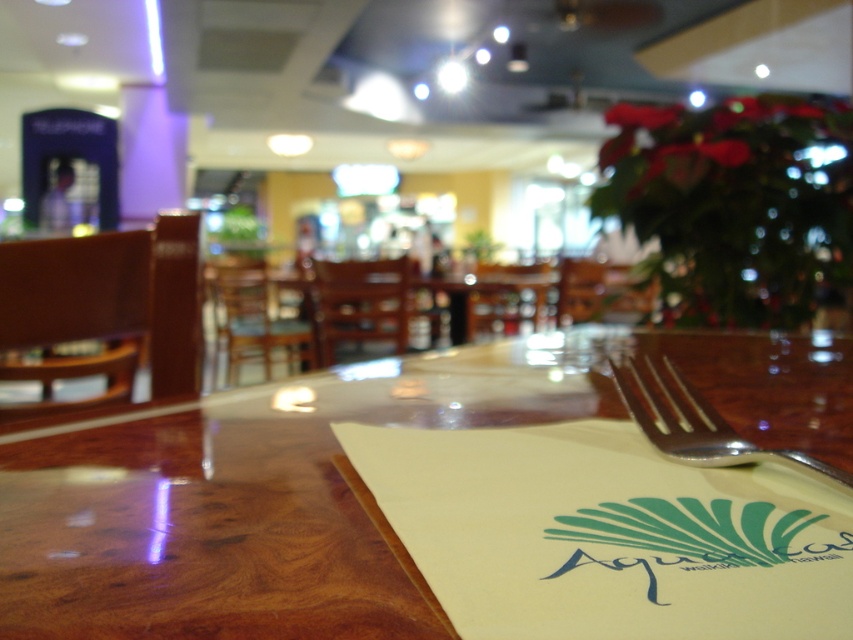
Question: From the image, what is the correct spatial relationship of wooden at center in relation to silver metallic fork at lower right?

Choices:
 (A) above
 (B) below

Answer: (B)

Question: Is wooden at center further to the viewer compared to silver metallic fork at lower right?

Choices:
 (A) no
 (B) yes

Answer: (A)

Question: Can you confirm if wooden at center is positioned to the right of silver metallic fork at lower right?

Choices:
 (A) no
 (B) yes

Answer: (A)

Question: Which object appears closest to the camera in this image?

Choices:
 (A) wooden at center
 (B) silver metallic fork at lower right

Answer: (A)

Question: Among these points, which one is nearest to the camera?

Choices:
 (A) (96, 561)
 (B) (653, 360)

Answer: (A)